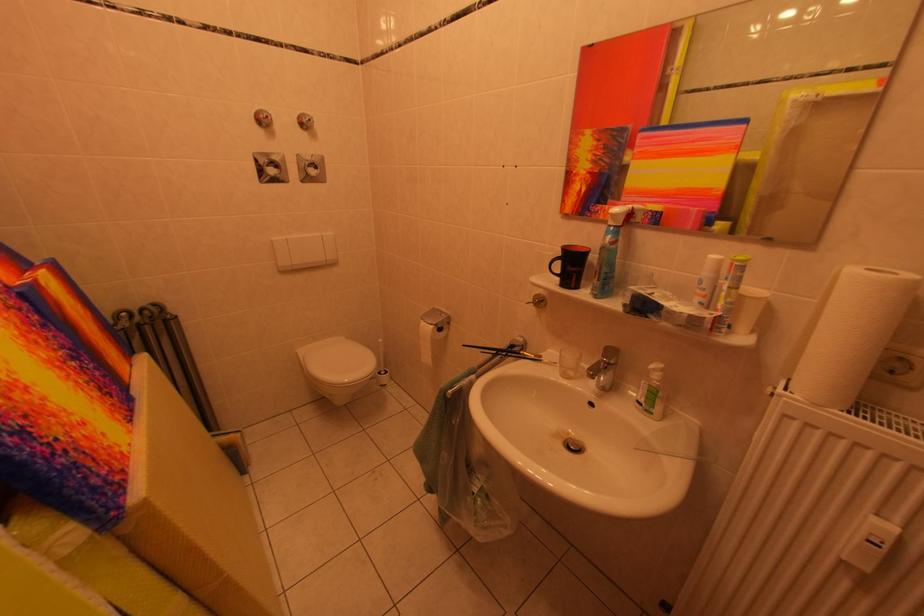
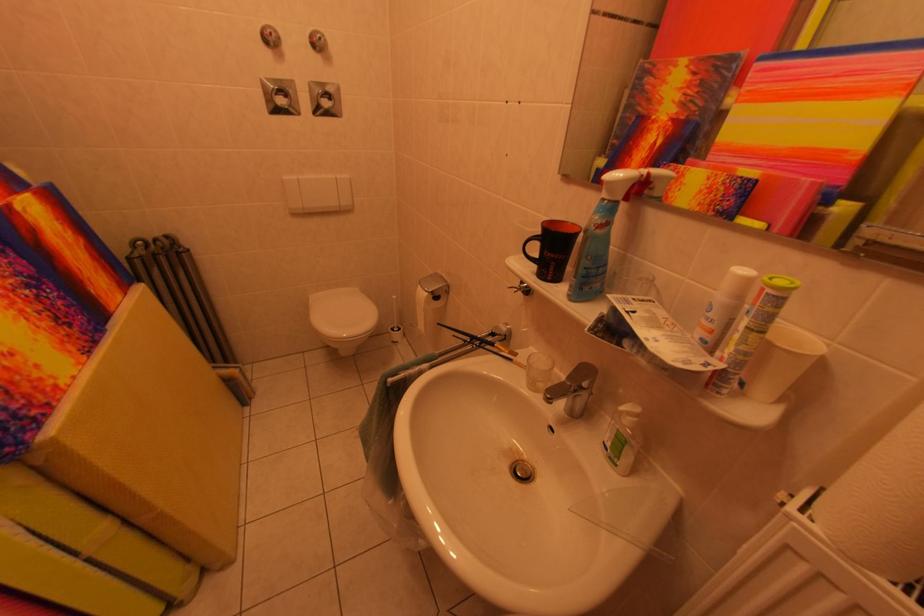
Locate, in the second image, the point that corresponds to point (622, 249) in the first image.

(606, 235)